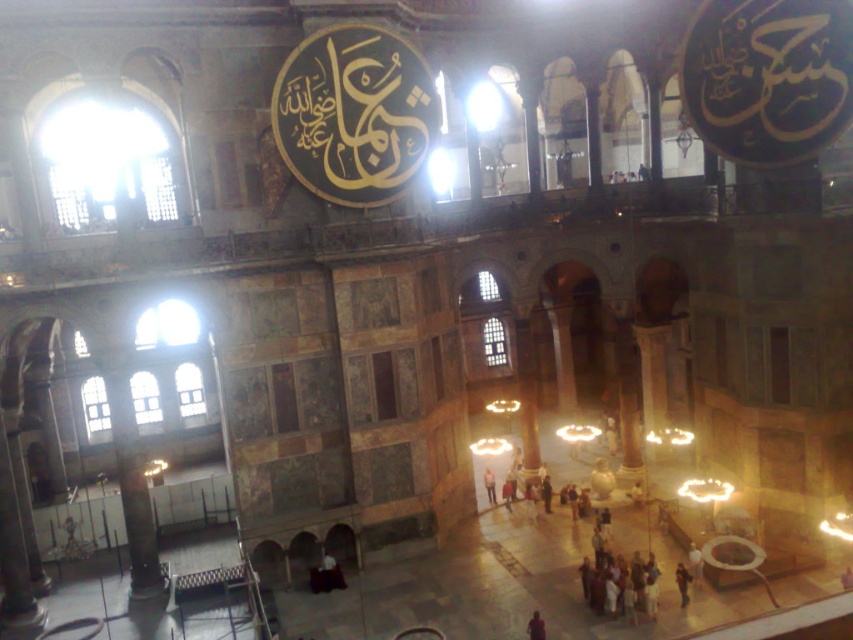
Does polished marble pillar at lower left have a larger size compared to dark brown leather jacket at center?

Indeed, polished marble pillar at lower left has a larger size compared to dark brown leather jacket at center.

Does polished marble pillar at lower left have a lesser height compared to dark brown leather jacket at center?

In fact, polished marble pillar at lower left may be taller than dark brown leather jacket at center.

Is point (154, 577) positioned in front of point (543, 621)?

No, (154, 577) is further to viewer.

Where is `polished marble pillar at lower left`? Image resolution: width=853 pixels, height=640 pixels. polished marble pillar at lower left is located at coordinates (138, 528).

Is polished marble pillar at lower left above light brown leather jacket at center?

Yes, polished marble pillar at lower left is above light brown leather jacket at center.

Is polished marble pillar at lower left positioned before light brown leather jacket at center?

Yes, polished marble pillar at lower left is in front of light brown leather jacket at center.

Where is `polished marble pillar at lower left`? polished marble pillar at lower left is located at coordinates click(138, 528).

Between dark brown leather jacket at lower center and light brown leather jacket at center, which one has more height?

dark brown leather jacket at lower center

Does dark brown leather jacket at lower center have a lesser height compared to light brown leather jacket at center?

No.

What do you see at coordinates (682, 582) in the screenshot? I see `dark brown leather jacket at lower center` at bounding box center [682, 582].

The image size is (853, 640). In order to click on dark brown leather jacket at lower center in this screenshot , I will do `click(682, 582)`.